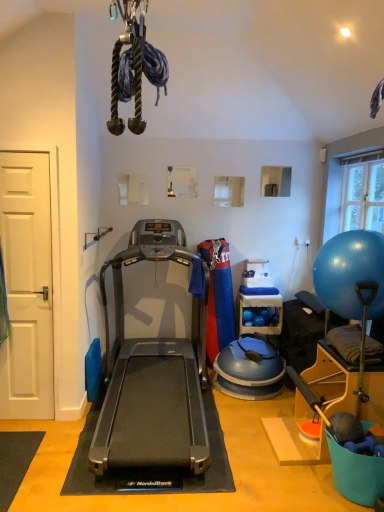
Question: Considering the relative sizes of wooden shelf at center and white matte door at left in the image provided, is wooden shelf at center thinner than white matte door at left?

Choices:
 (A) no
 (B) yes

Answer: (A)

Question: From a real-world perspective, does wooden shelf at center sit lower than white matte door at left?

Choices:
 (A) yes
 (B) no

Answer: (A)

Question: Is wooden shelf at center further to camera compared to white matte door at left?

Choices:
 (A) no
 (B) yes

Answer: (B)

Question: Does wooden shelf at center have a lesser height compared to white matte door at left?

Choices:
 (A) no
 (B) yes

Answer: (B)

Question: From a real-world perspective, is wooden shelf at center on white matte door at left?

Choices:
 (A) yes
 (B) no

Answer: (B)

Question: Is point (359, 200) closer or farther from the camera than point (274, 297)?

Choices:
 (A) closer
 (B) farther

Answer: (A)

Question: In terms of height, does transparent glass window at upper right look taller or shorter compared to wooden shelf at center?

Choices:
 (A) short
 (B) tall

Answer: (B)

Question: From a real-world perspective, relative to wooden shelf at center, is transparent glass window at upper right vertically above or below?

Choices:
 (A) above
 (B) below

Answer: (A)

Question: In the image, is transparent glass window at upper right positioned in front of or behind wooden shelf at center?

Choices:
 (A) behind
 (B) front

Answer: (B)

Question: Would you say white matte door at left is inside or outside silver metallic treadmill at center?

Choices:
 (A) outside
 (B) inside

Answer: (A)

Question: Considering their positions, is white matte door at left located in front of or behind silver metallic treadmill at center?

Choices:
 (A) front
 (B) behind

Answer: (B)

Question: In terms of height, does white matte door at left look taller or shorter compared to silver metallic treadmill at center?

Choices:
 (A) tall
 (B) short

Answer: (A)

Question: From a real-world perspective, is white matte door at left physically located above or below silver metallic treadmill at center?

Choices:
 (A) above
 (B) below

Answer: (A)

Question: From the image's perspective, is white matte door at left located above or below wooden shelf at center?

Choices:
 (A) above
 (B) below

Answer: (A)

Question: Is white matte door at left taller or shorter than wooden shelf at center?

Choices:
 (A) short
 (B) tall

Answer: (B)